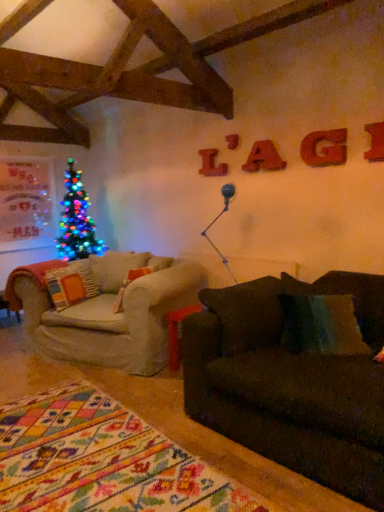
Question: Could metallic red letter at upper right, the 1th letter from the front, be considered to be inside orange fabric pillow at left?

Choices:
 (A) no
 (B) yes

Answer: (A)

Question: Is metallic red letter at upper right, acting as the 4th letter starting from the left, at the back of orange fabric pillow at left?

Choices:
 (A) no
 (B) yes

Answer: (A)

Question: Does orange fabric pillow at left have a larger size compared to metallic red letter at upper right, positioned as the first letter in right-to-left order?

Choices:
 (A) yes
 (B) no

Answer: (A)

Question: Is the depth of orange fabric pillow at left greater than that of metallic red letter at upper right, the 1th letter from the front?

Choices:
 (A) yes
 (B) no

Answer: (A)

Question: Can you confirm if orange fabric pillow at left is smaller than metallic red letter at upper right, positioned as the first letter in right-to-left order?

Choices:
 (A) no
 (B) yes

Answer: (A)

Question: From a real-world perspective, is orange fabric pillow at left over metallic red letter at upper right, acting as the 4th letter starting from the left?

Choices:
 (A) no
 (B) yes

Answer: (A)

Question: From a real-world perspective, is metallic red letter at upper right, positioned as the first letter in right-to-left order, on top of red wood letter at upper center, the first letter when ordered from back to front?

Choices:
 (A) yes
 (B) no

Answer: (A)

Question: Considering the relative sizes of metallic red letter at upper right, positioned as the first letter in right-to-left order, and red wood letter at upper center, placed as the 4th letter when sorted from front to back, in the image provided, is metallic red letter at upper right, positioned as the first letter in right-to-left order, wider than red wood letter at upper center, placed as the 4th letter when sorted from front to back,?

Choices:
 (A) yes
 (B) no

Answer: (A)

Question: Would you say metallic red letter at upper right, acting as the 4th letter starting from the left, is outside red wood letter at upper center, which is the 1th letter in left-to-right order?

Choices:
 (A) no
 (B) yes

Answer: (B)

Question: Does metallic red letter at upper right, the 1th letter from the front, have a greater height compared to red wood letter at upper center, the first letter when ordered from back to front?

Choices:
 (A) no
 (B) yes

Answer: (A)

Question: Is metallic red letter at upper right, positioned as the first letter in right-to-left order, oriented away from red wood letter at upper center, which is the 1th letter in left-to-right order?

Choices:
 (A) no
 (B) yes

Answer: (A)

Question: Does metallic red letter at upper right, positioned as the first letter in right-to-left order, turn towards red wood letter at upper center, which is the 1th letter in left-to-right order?

Choices:
 (A) no
 (B) yes

Answer: (A)

Question: Can you confirm if metallic red letter at upper right, the 1th letter from the front, is wider than matte red letter at upper center, the 3th letter in the front-to-back sequence?

Choices:
 (A) yes
 (B) no

Answer: (B)